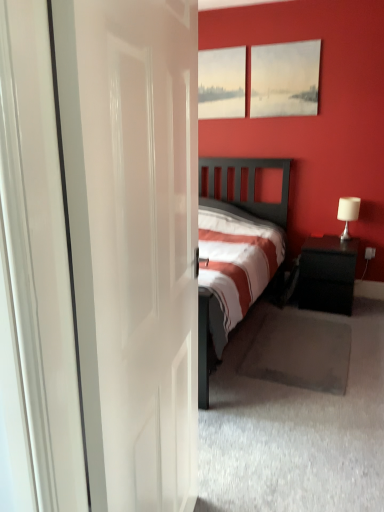
Question: Is matte white painting at upper center next to black glossy nightstand at right and touching it?

Choices:
 (A) no
 (B) yes

Answer: (A)

Question: Does matte white painting at upper center have a lesser width compared to black glossy nightstand at right?

Choices:
 (A) no
 (B) yes

Answer: (B)

Question: From the image's perspective, does matte white painting at upper center appear higher than black glossy nightstand at right?

Choices:
 (A) yes
 (B) no

Answer: (A)

Question: Is matte white painting at upper center taller than black glossy nightstand at right?

Choices:
 (A) no
 (B) yes

Answer: (B)

Question: Is there a large distance between matte white painting at upper center and black glossy nightstand at right?

Choices:
 (A) yes
 (B) no

Answer: (A)

Question: From the image's perspective, relative to matte white painting at upper center, is matte canvas painting at upper center above or below?

Choices:
 (A) above
 (B) below

Answer: (B)

Question: In terms of size, does matte canvas painting at upper center appear bigger or smaller than matte white painting at upper center?

Choices:
 (A) big
 (B) small

Answer: (A)

Question: Is point (316, 111) closer or farther from the camera than point (226, 114)?

Choices:
 (A) farther
 (B) closer

Answer: (B)

Question: From a real-world perspective, relative to matte white painting at upper center, is matte canvas painting at upper center vertically above or below?

Choices:
 (A) above
 (B) below

Answer: (B)

Question: In the image, is white fabric lampshade at right on the left side or the right side of matte canvas painting at upper center?

Choices:
 (A) left
 (B) right

Answer: (B)

Question: From a real-world perspective, relative to matte canvas painting at upper center, is white fabric lampshade at right vertically above or below?

Choices:
 (A) above
 (B) below

Answer: (B)

Question: Does point (344, 230) appear closer or farther from the camera than point (278, 64)?

Choices:
 (A) farther
 (B) closer

Answer: (A)

Question: Choose the correct answer: Is white fabric lampshade at right inside matte canvas painting at upper center or outside it?

Choices:
 (A) outside
 (B) inside

Answer: (A)

Question: Based on their positions, is white fabric lampshade at right located to the left or right of white glossy door at center?

Choices:
 (A) right
 (B) left

Answer: (A)

Question: Relative to white glossy door at center, is white fabric lampshade at right in front or behind?

Choices:
 (A) behind
 (B) front

Answer: (A)